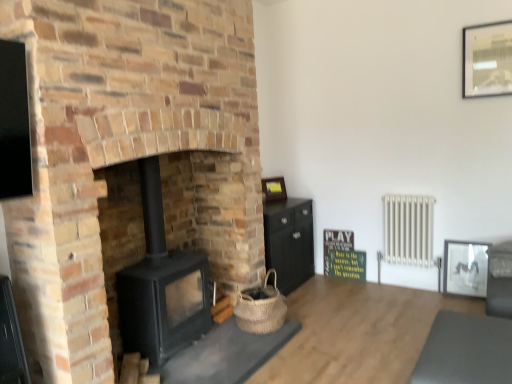
Identify the location of free space on the front side of woven natural basket at lower center. This screenshot has height=384, width=512. (238, 345).